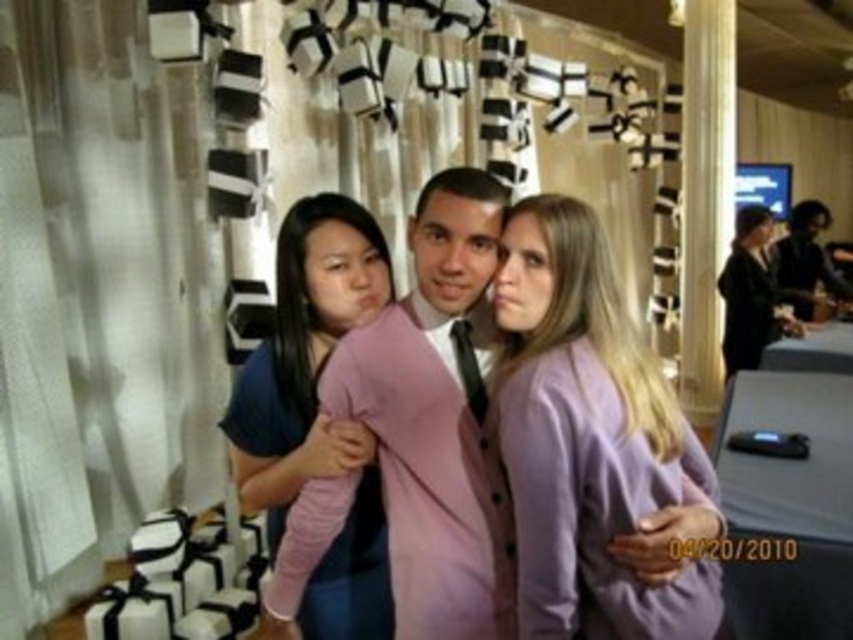
Between point (596, 259) and point (306, 605), which one is positioned in front?

Point (596, 259) is in front.

Which is behind, point (509, 232) or point (230, 438)?

Point (230, 438)

The image size is (853, 640). I want to click on purple fabric shirt at center, so click(587, 436).

Is point (450, 384) positioned in front of point (392, 614)?

That is True.

Which of these two, pink fabric sweater at center or pink matte sweater at center, stands shorter?

pink fabric sweater at center

At what (x,y) coordinates should I click in order to perform the action: click on pink fabric sweater at center. Please return your answer as a coordinate pair (x, y). The width and height of the screenshot is (853, 640). Looking at the image, I should click on (436, 419).

Locate an element on the screen. pink fabric sweater at center is located at coordinates (436, 419).

Can you confirm if pink fabric sweater at center is wider than purple fabric shirt at center?

Yes.

Where is `pink fabric sweater at center`? This screenshot has height=640, width=853. pink fabric sweater at center is located at coordinates (436, 419).